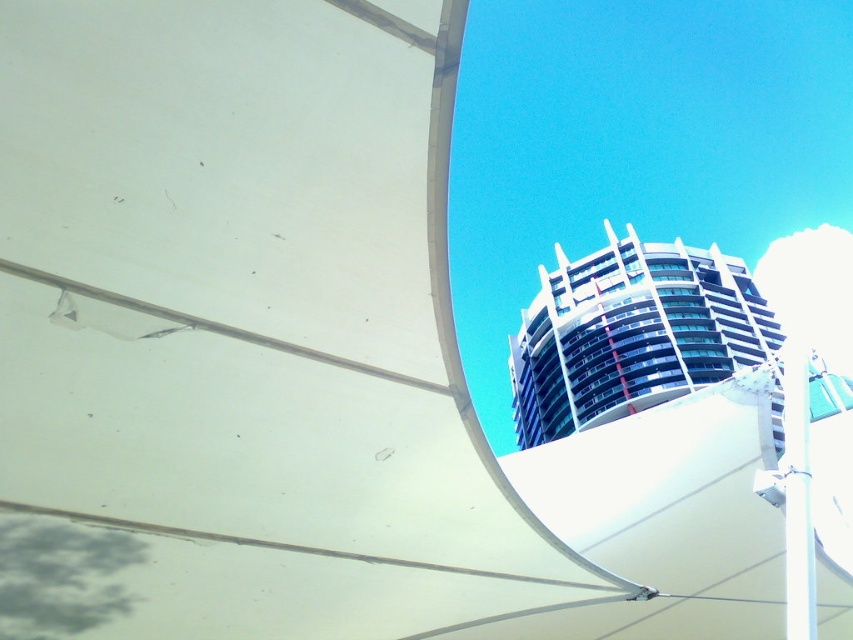
You are standing in the city and want to take a photo of the white glass building at upper center and the white glossy pole at right. Which object should you focus on first to ensure both are in the same frame?

You should focus on the white glass building at upper center first because it is closer to you than the white glossy pole at right, so adjusting the camera to include both would require framing starting from the closer object.

You are an architect analyzing the urban layout. Given the white glass building at upper center and the white glossy pole at right, which object is located closer to the ground level?

The white glossy pole at right is closer to the ground level because the white glass building at upper center is positioned under it.